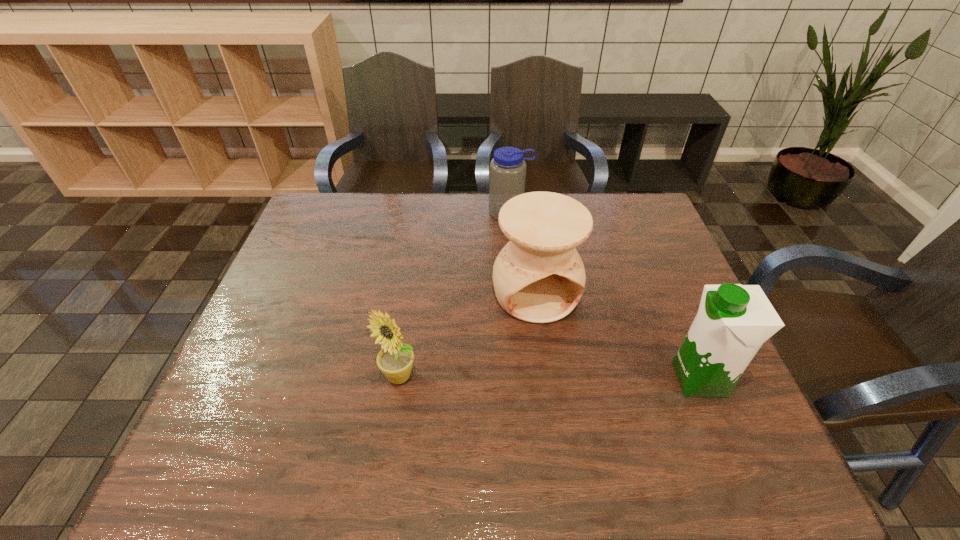
Locate an element on the screen. This screenshot has width=960, height=540. vacant space on the desktop that is between the leftmost object and the rightmost object and is positioned with a carrying loop on the side of the water bottle is located at coordinates (548, 377).

The width and height of the screenshot is (960, 540). I want to click on vacant space on the desktop that is between the leftmost object and the rightmost object and is positioned at the open side of the second farthest object, so click(x=574, y=378).